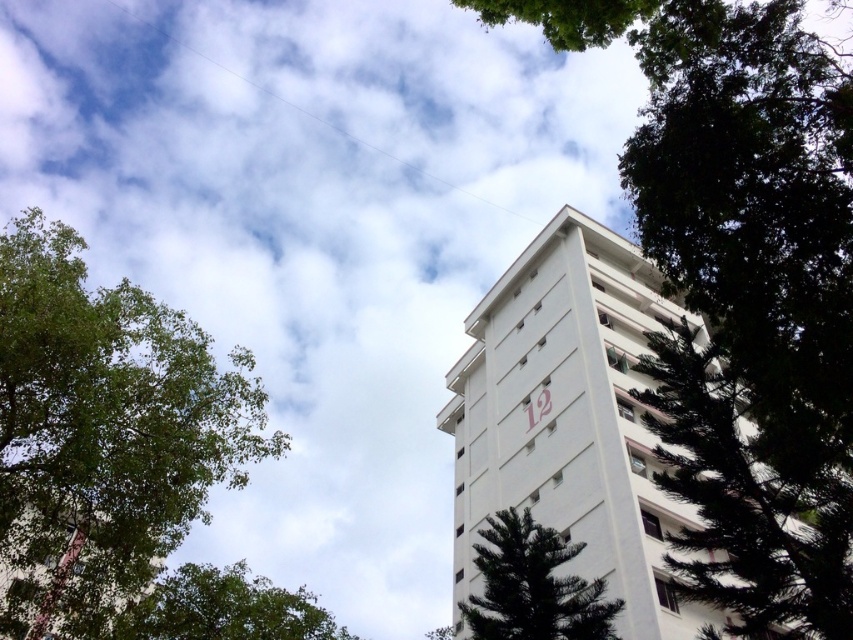
You are standing in front of the tall white residential building with the red number 12. You need to take a photo of the building without any trees blocking the view. Based on the green leafy tree at left, where should you position yourself to avoid it?

The green leafy tree at left is located at point (103, 433) in the image. To avoid it, position yourself to the right side of the scene so the tree is out of frame or obscured by other elements.

You are standing in front of the tall white residential building with the red number 12. You notice two trees, the green leafy tree at left and the green textured tree at center. Which tree is higher up in the image?

The green leafy tree at left is located above the green textured tree at center, so it is higher up in the image.